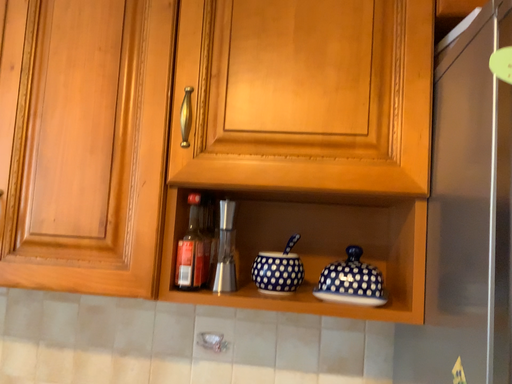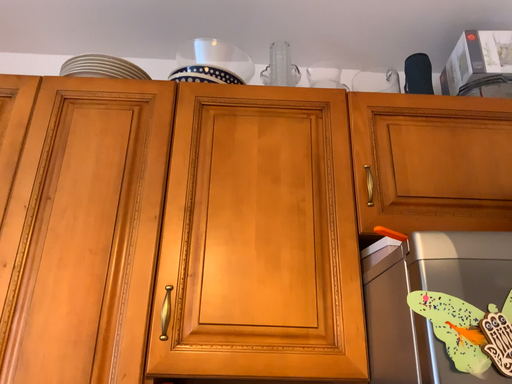
Question: How did the camera likely rotate when shooting the video?

Choices:
 (A) rotated right
 (B) rotated left

Answer: (A)